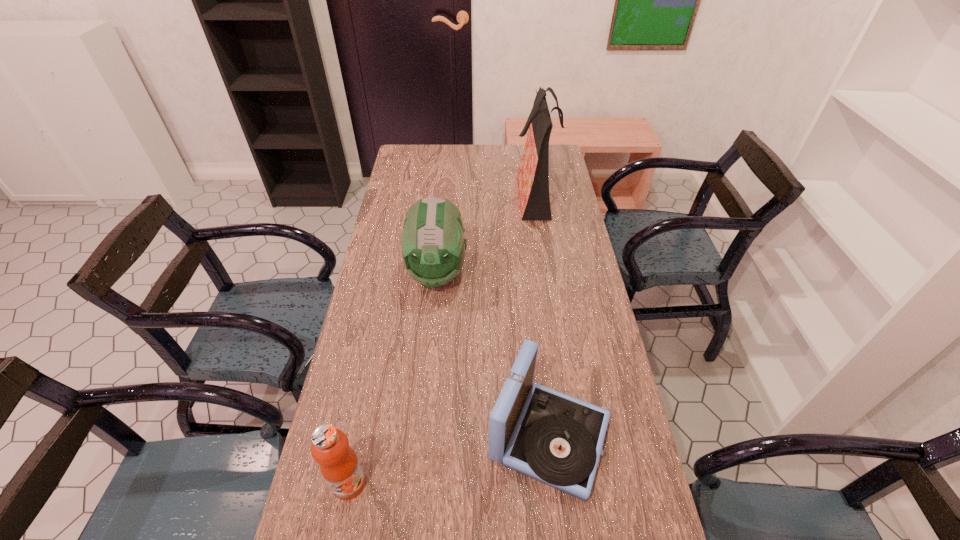
This screenshot has width=960, height=540. I want to click on vacant space at the right edge, so click(612, 351).

Find the location of a particular element. The height and width of the screenshot is (540, 960). empty space between the third object from right to left and the leftmost object is located at coordinates click(x=394, y=378).

Image resolution: width=960 pixels, height=540 pixels. I want to click on empty space between the fruit juice and the phonograph record, so click(x=449, y=461).

Locate an element on the screen. The image size is (960, 540). vacant area that lies between the football helmet and the farthest object is located at coordinates (486, 233).

Locate an element on the screen. Image resolution: width=960 pixels, height=540 pixels. free spot between the leftmost object and the second farthest object is located at coordinates (394, 378).

Where is `unoccupied area between the leftmost object and the second farthest object`? This screenshot has width=960, height=540. unoccupied area between the leftmost object and the second farthest object is located at coordinates coord(394,378).

Locate an element on the screen. This screenshot has width=960, height=540. free space between the second object from left to right and the phonograph record is located at coordinates [493, 355].

The height and width of the screenshot is (540, 960). I want to click on vacant region between the phonograph record and the fruit juice, so click(449, 461).

Find the location of a particular element. This screenshot has height=540, width=960. free space that is in between the phonograph record and the fruit juice is located at coordinates (449, 461).

This screenshot has height=540, width=960. Find the location of `free spot between the leftmost object and the shopping bag`. free spot between the leftmost object and the shopping bag is located at coordinates (442, 339).